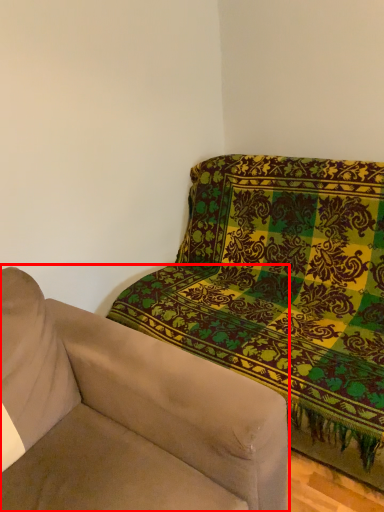
Question: From the image's perspective, where is studio couch (annotated by the red box) located relative to studio sofa?

Choices:
 (A) below
 (B) above

Answer: (A)